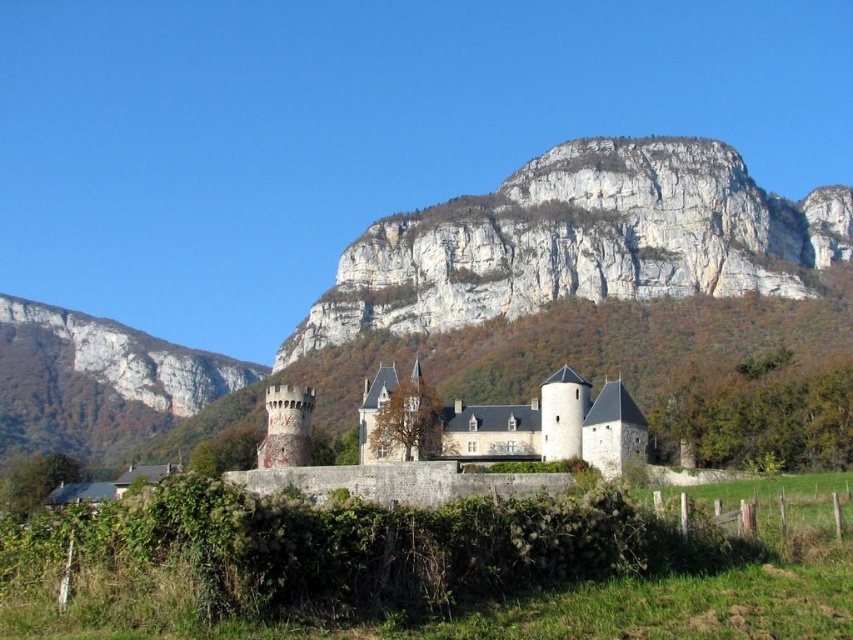
Question: Does white rock cliff at upper center have a greater width compared to smooth gray rock at left?

Choices:
 (A) yes
 (B) no

Answer: (A)

Question: Is white rock cliff at upper center positioned behind smooth gray rock at left?

Choices:
 (A) no
 (B) yes

Answer: (A)

Question: Estimate the real-world distances between objects in this image. Which object is farther from the white rock cliff at upper center?

Choices:
 (A) smooth gray rock at left
 (B) stone castle at center

Answer: (A)

Question: Which of these objects is positioned closest to the white rock cliff at upper center?

Choices:
 (A) stone castle at center
 (B) smooth gray rock at left

Answer: (A)

Question: Where is white rock cliff at upper center located in relation to smooth gray rock at left in the image?

Choices:
 (A) left
 (B) right

Answer: (B)

Question: Which point is closer to the camera?

Choices:
 (A) smooth gray rock at left
 (B) white rock cliff at upper center
 (C) stone castle at center

Answer: (C)